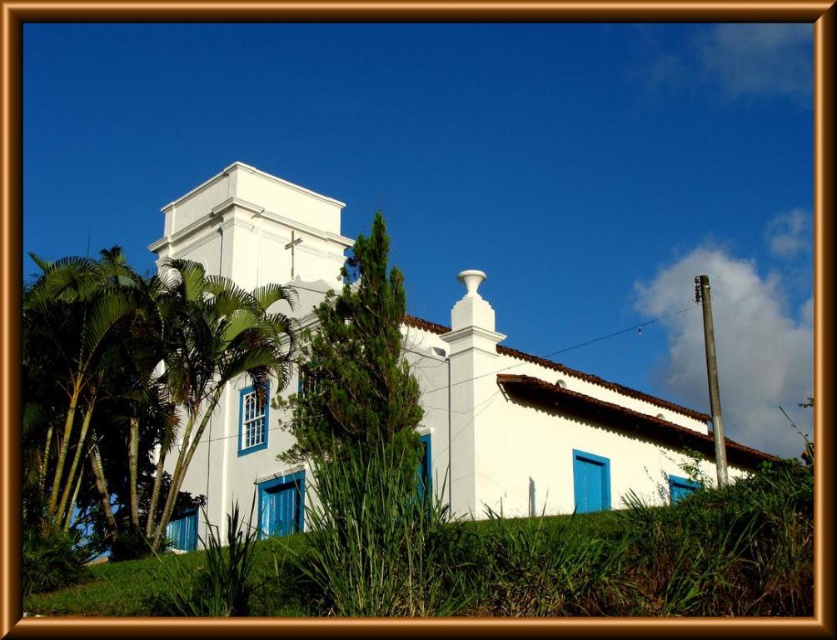
Question: Is white stucco church at center to the right of green leafy palm tree at left from the viewer's perspective?

Choices:
 (A) no
 (B) yes

Answer: (B)

Question: Does white stucco church at center appear under green leafy palm tree at left?

Choices:
 (A) no
 (B) yes

Answer: (A)

Question: Which point is farther from the camera taking this photo?

Choices:
 (A) (686, 492)
 (B) (85, 397)

Answer: (A)

Question: Does white stucco church at center appear on the left side of green leafy palm tree at left?

Choices:
 (A) yes
 (B) no

Answer: (B)

Question: Which point is farther from the camera taking this photo?

Choices:
 (A) (21, 340)
 (B) (551, 428)

Answer: (B)